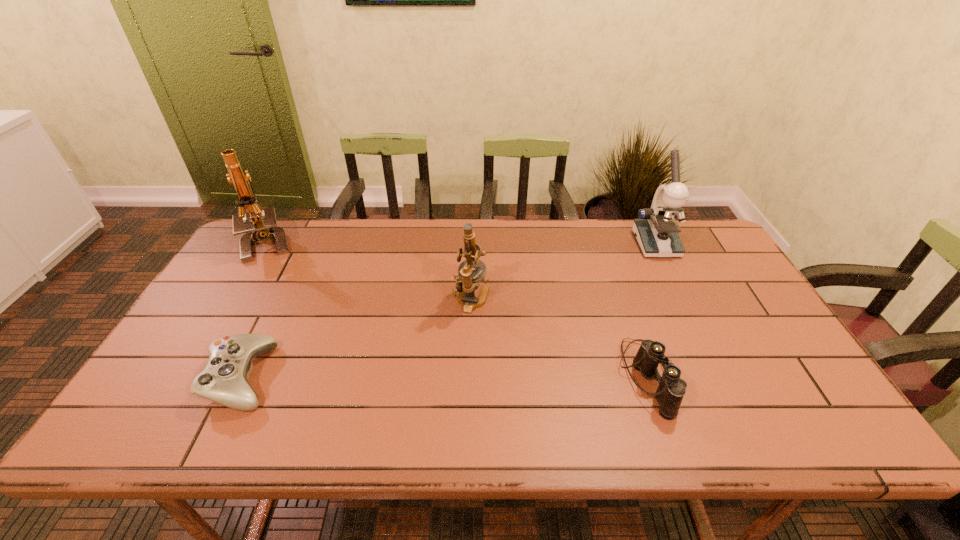
Find the location of a particular element. vacant position in the image that satisfies the following two spatial constraints: 1. at the eyepiece of the leftmost microscope; 2. on the right side of the third farthest object is located at coordinates (234, 301).

Identify the location of blank space that satisfies the following two spatial constraints: 1. on the back side of the third object from left to right; 2. on the right side of the rightmost microscope. This screenshot has height=540, width=960. (472, 244).

In order to click on blank area in the image that satisfies the following two spatial constraints: 1. on the back side of the rightmost object; 2. on the right side of the control in this screenshot , I will do `click(307, 244)`.

This screenshot has height=540, width=960. Find the location of `blank space that satisfies the following two spatial constraints: 1. at the eyepiece of the leftmost microscope; 2. on the right side of the nearest microscope`. blank space that satisfies the following two spatial constraints: 1. at the eyepiece of the leftmost microscope; 2. on the right side of the nearest microscope is located at coordinates (234, 301).